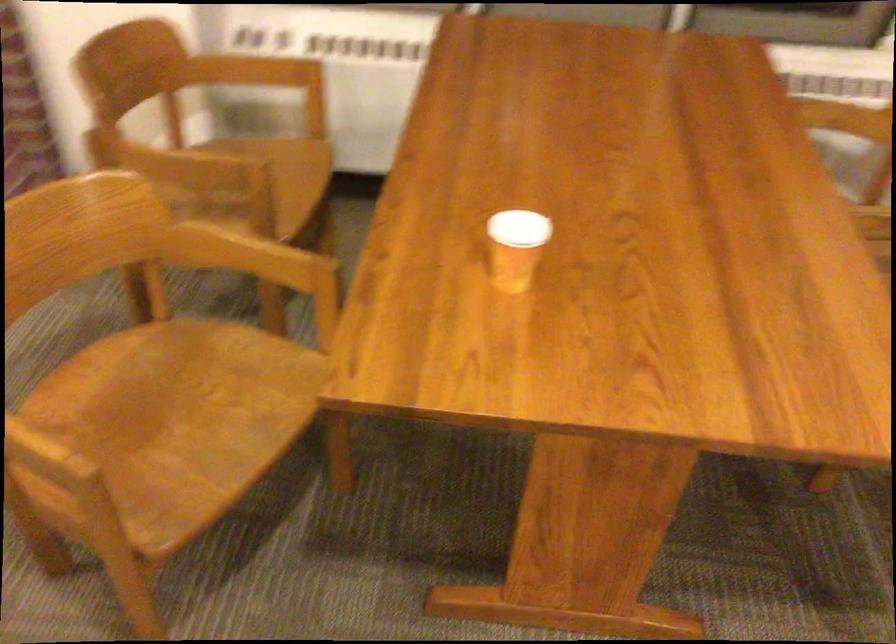
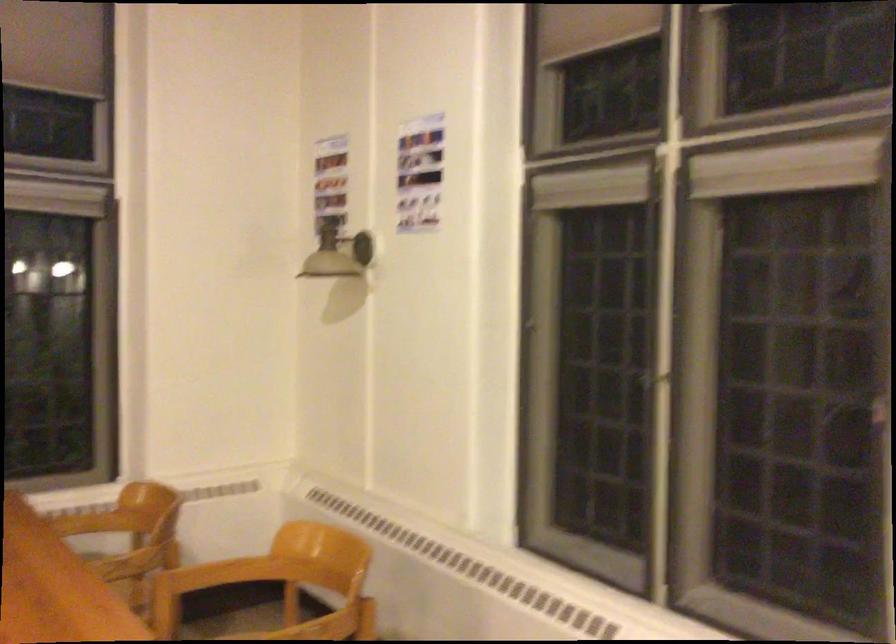
In the scene shown: How did the camera likely rotate?

The rotation direction of the camera is right-up.